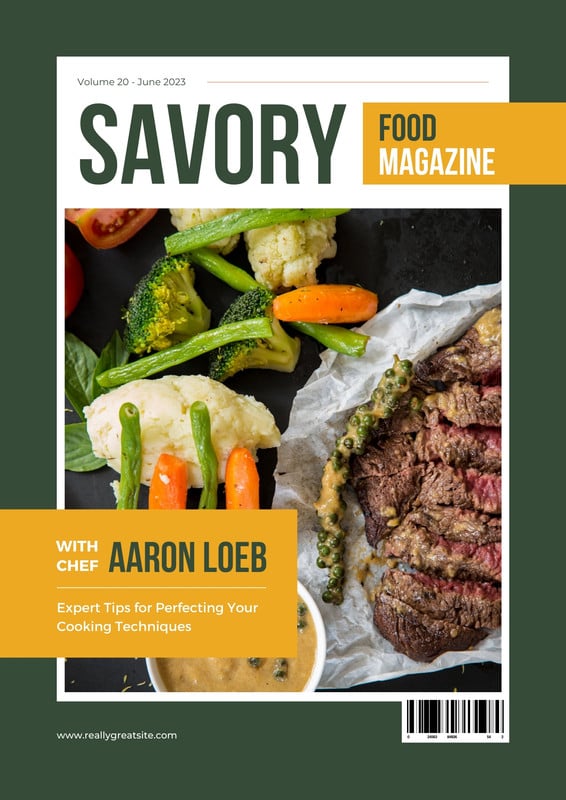
What are the coordinates of `cup` in the screenshot? It's located at coord(319,656).